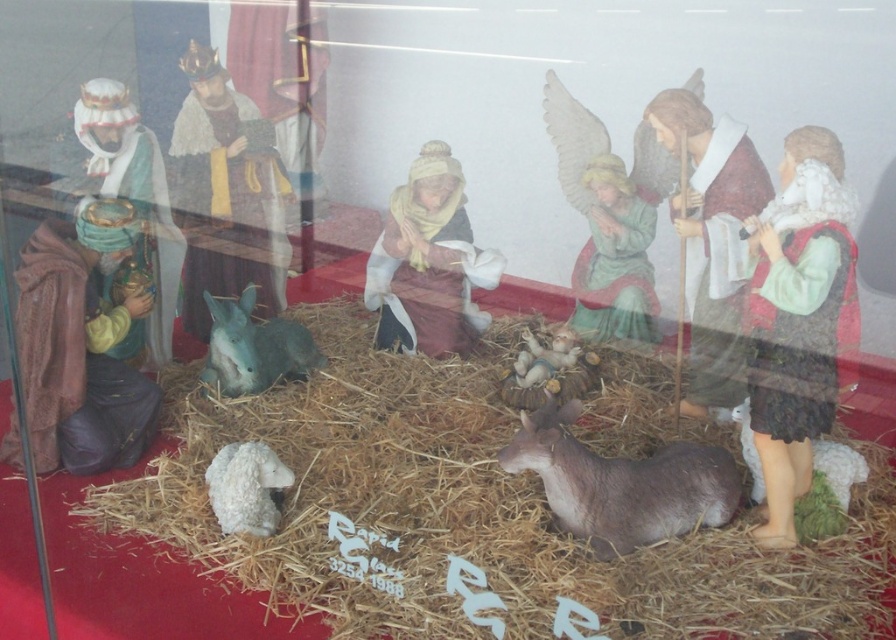
Is fuzzy brown donkey at lower center taller than white woolen lamb at lower left?

Correct, fuzzy brown donkey at lower center is much taller as white woolen lamb at lower left.

Consider the image. Can you confirm if fuzzy brown donkey at lower center is shorter than white woolen lamb at lower left?

In fact, fuzzy brown donkey at lower center may be taller than white woolen lamb at lower left.

Which is behind, point (573, 504) or point (253, 525)?

The point (253, 525) is behind.

You are a GUI agent. You are given a task and a screenshot of the screen. Output one action in this format:
    pyautogui.click(x=<x>, y=<y>)
    Task: Click on the fuzzy brown donkey at lower center
    Image resolution: width=896 pixels, height=640 pixels.
    Given the screenshot: What is the action you would take?
    pyautogui.click(x=621, y=483)

I want to click on fuzzy brown donkey at lower center, so 621,483.

Does point (536, 452) lie behind point (243, 388)?

No, it is not.

The height and width of the screenshot is (640, 896). I want to click on fuzzy brown donkey at lower center, so click(x=621, y=483).

Can you confirm if white woolen lamb at lower right is bigger than smooth beige baby at center?

Yes.

Does point (823, 454) lie behind point (517, 384)?

No, it is not.

Is point (866, 465) behind point (528, 378)?

No, it is not.

The image size is (896, 640). What are the coordinates of `white woolen lamb at lower right` in the screenshot? It's located at (840, 467).